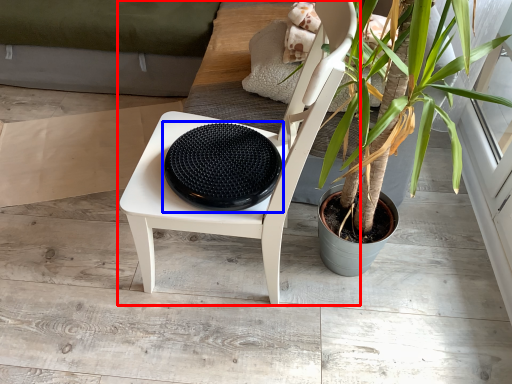
Question: Which of the following is the farthest to the observer, chair (highlighted by a red box) or manhole cover (highlighted by a blue box)?

Choices:
 (A) chair
 (B) manhole cover

Answer: (B)